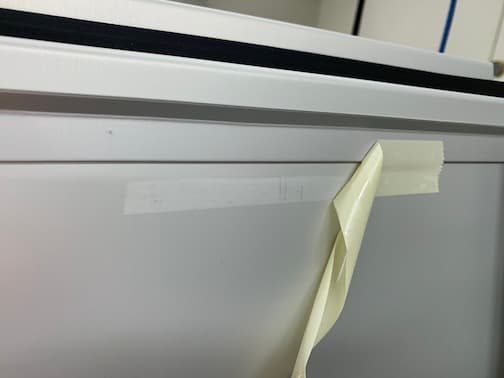
Locate an element on the screen. This screenshot has width=504, height=378. wall is located at coordinates (415, 15).